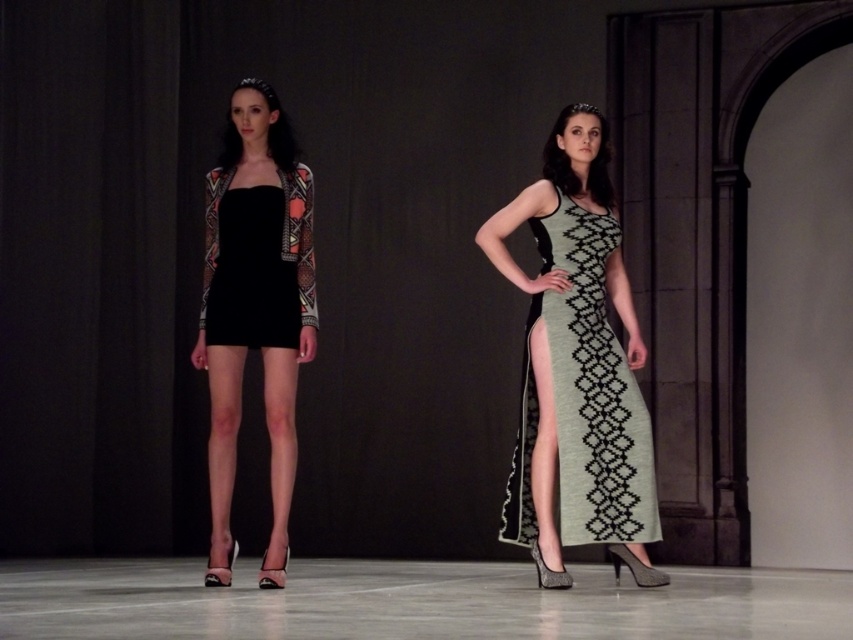
Question: Considering the real-world distances, which object is farthest from the black matte dress at center?

Choices:
 (A) matte black dress at center
 (B) green textured dress at center

Answer: (B)

Question: Which point is closer to the camera?

Choices:
 (A) matte black dress at center
 (B) green textured dress at center
 (C) black matte dress at center

Answer: (B)

Question: Considering the real-world distances, which object is closest to the matte black dress at center?

Choices:
 (A) black matte dress at center
 (B) green textured dress at center

Answer: (A)

Question: Is green textured dress at center to the right of black matte dress at center from the viewer's perspective?

Choices:
 (A) yes
 (B) no

Answer: (A)

Question: From the image, what is the correct spatial relationship of matte black dress at center in relation to green textured dress at center?

Choices:
 (A) above
 (B) below

Answer: (A)

Question: Is green textured dress at center below black matte dress at center?

Choices:
 (A) no
 (B) yes

Answer: (B)